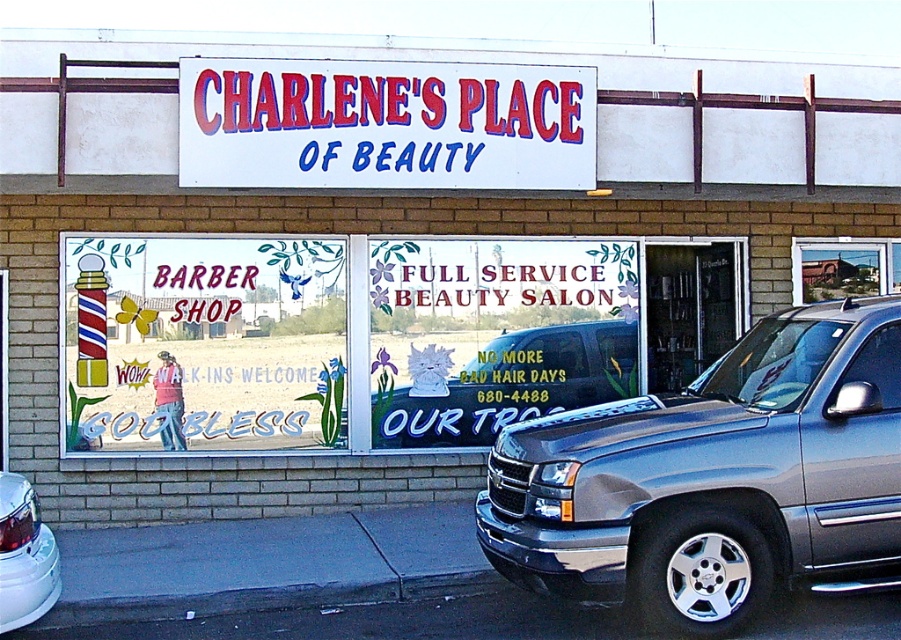
Question: Is white plastic sign at center bigger than metallic silver car at center?

Choices:
 (A) yes
 (B) no

Answer: (A)

Question: Is metallic gray suv at center above white glossy car at lower left?

Choices:
 (A) yes
 (B) no

Answer: (A)

Question: Based on their relative distances, which object is farther from the white plastic sign at center?

Choices:
 (A) matte black pickup truck at center
 (B) white glossy car at lower left

Answer: (B)

Question: Which point appears farthest from the camera in this image?

Choices:
 (A) (511, 68)
 (B) (763, 433)
 (C) (14, 502)
 (D) (796, 292)

Answer: (D)

Question: Estimate the real-world distances between objects in this image. Which object is closer to the metallic silver car at center?

Choices:
 (A) white plastic sign at center
 (B) white glossy car at lower left
 (C) matte black pickup truck at center
 (D) metallic gray suv at center

Answer: (C)

Question: Where is metallic gray suv at center located in relation to metallic silver car at center in the image?

Choices:
 (A) right
 (B) left

Answer: (B)